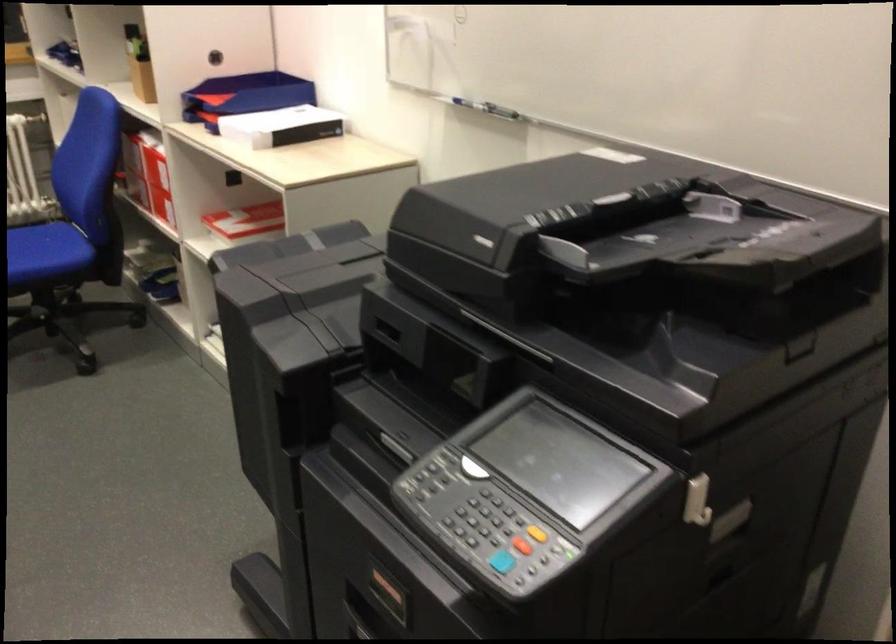
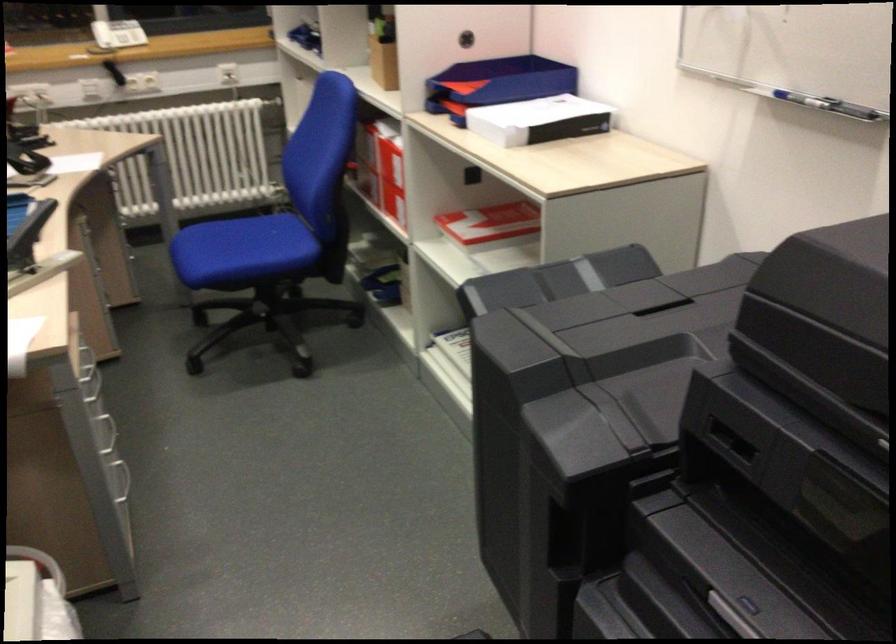
In the second image, find the point that corresponds to pixel 243 98 in the first image.

(495, 84)